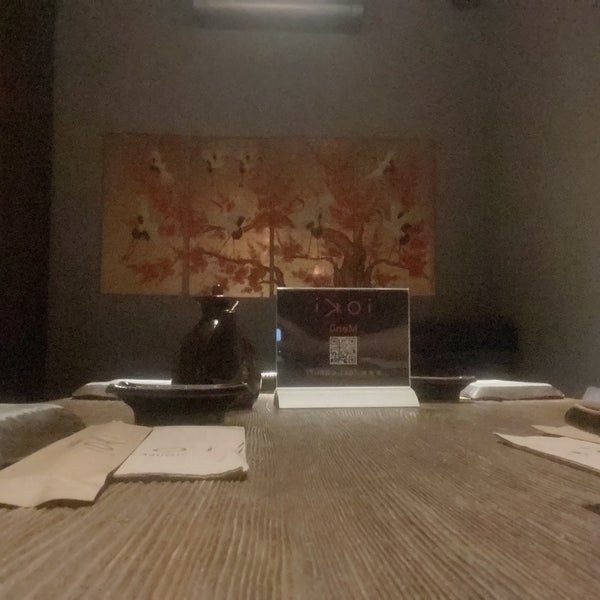
Identify the location of paper napkins. This screenshot has height=600, width=600. (186, 449), (577, 451).